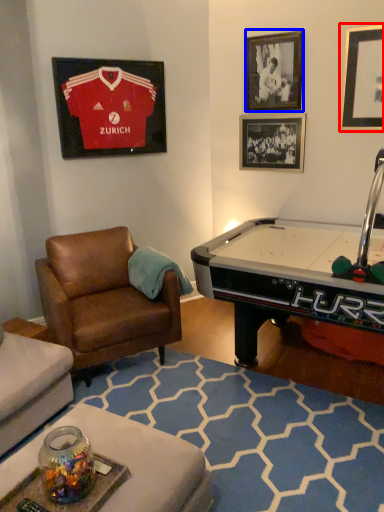
Question: Which point is closer to the camera, picture frame (highlighted by a red box) or picture frame (highlighted by a blue box)?

Choices:
 (A) picture frame
 (B) picture frame

Answer: (A)